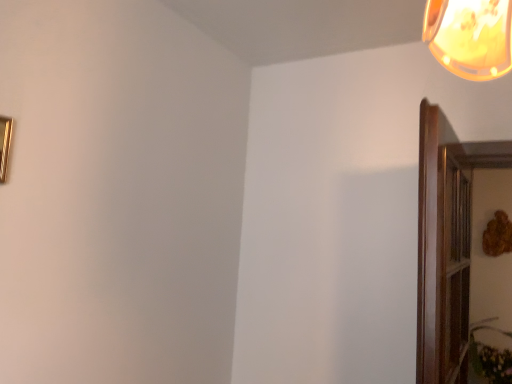
Question: Considering the relative sizes of gold metallic picture frame at upper left and green leafy plant at lower right in the image provided, is gold metallic picture frame at upper left shorter than green leafy plant at lower right?

Choices:
 (A) yes
 (B) no

Answer: (A)

Question: Considering the relative sizes of gold metallic picture frame at upper left and green leafy plant at lower right in the image provided, is gold metallic picture frame at upper left wider than green leafy plant at lower right?

Choices:
 (A) yes
 (B) no

Answer: (B)

Question: Can you confirm if gold metallic picture frame at upper left is thinner than green leafy plant at lower right?

Choices:
 (A) yes
 (B) no

Answer: (A)

Question: Does gold metallic picture frame at upper left have a larger size compared to green leafy plant at lower right?

Choices:
 (A) no
 (B) yes

Answer: (A)

Question: From the image's perspective, is gold metallic picture frame at upper left beneath green leafy plant at lower right?

Choices:
 (A) yes
 (B) no

Answer: (B)

Question: Is gold metallic picture frame at upper left at the left side of green leafy plant at lower right?

Choices:
 (A) no
 (B) yes

Answer: (B)

Question: Is the position of green leafy plant at lower right less distant than that of gold metallic picture frame at upper left?

Choices:
 (A) yes
 (B) no

Answer: (B)

Question: Is the position of green leafy plant at lower right more distant than that of gold metallic picture frame at upper left?

Choices:
 (A) yes
 (B) no

Answer: (A)

Question: From the image's perspective, is green leafy plant at lower right on gold metallic picture frame at upper left?

Choices:
 (A) yes
 (B) no

Answer: (B)

Question: Is gold metallic picture frame at upper left completely or partially inside green leafy plant at lower right?

Choices:
 (A) no
 (B) yes

Answer: (A)

Question: Is green leafy plant at lower right not near gold metallic picture frame at upper left?

Choices:
 (A) yes
 (B) no

Answer: (A)

Question: Considering the relative sizes of green leafy plant at lower right and gold metallic picture frame at upper left in the image provided, is green leafy plant at lower right taller than gold metallic picture frame at upper left?

Choices:
 (A) no
 (B) yes

Answer: (B)

Question: From the image's perspective, relative to green leafy plant at lower right, is gold metallic picture frame at upper left above or below?

Choices:
 (A) above
 (B) below

Answer: (A)